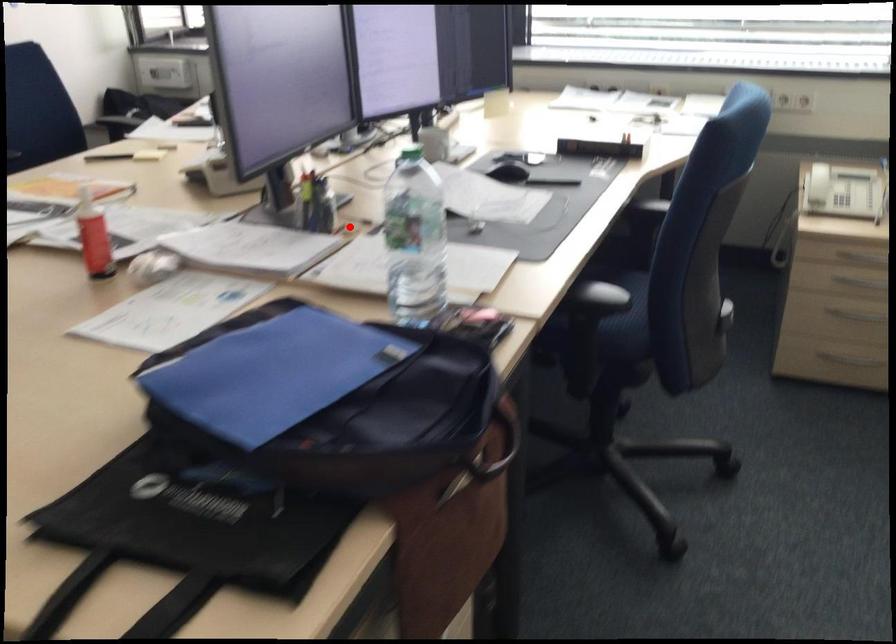
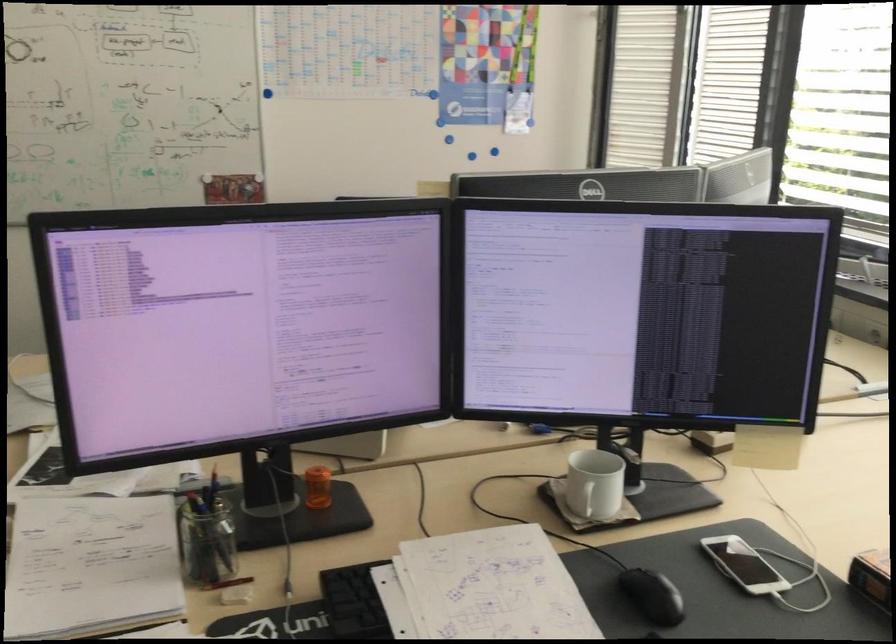
Locate, in the second image, the point that corresponds to the highlighted location in the first image.

(234, 596)